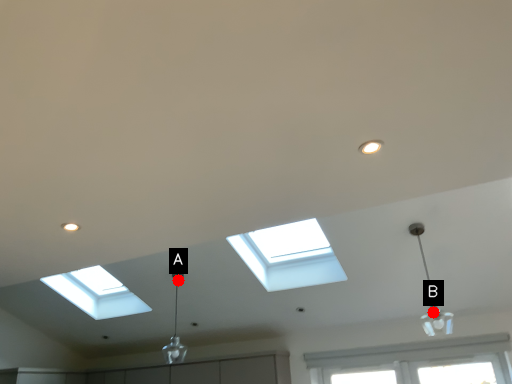
Question: Two points are circled on the image, labeled by A and B beside each circle. Which point is farther to the camera?

Choices:
 (A) A is further
 (B) B is further

Answer: (A)